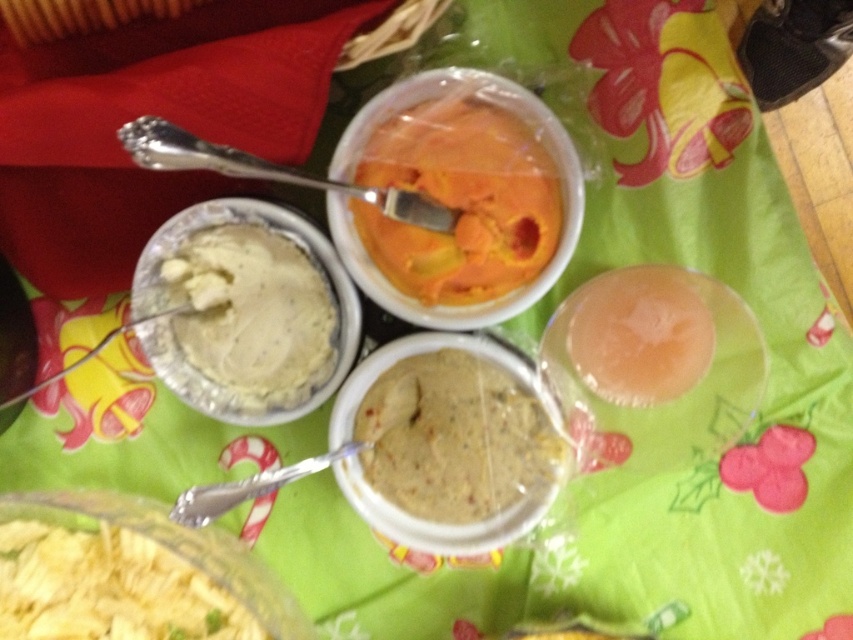
Question: Which point is closer to the camera taking this photo?

Choices:
 (A) (469, 288)
 (B) (674, 305)
 (C) (71, 614)

Answer: (C)

Question: Is orange matte ice cream at center to the right of white creamy paste at center from the viewer's perspective?

Choices:
 (A) no
 (B) yes

Answer: (B)

Question: Which of the following is the closest to the observer?

Choices:
 (A) white creamy paste at center
 (B) translucent plastic cup at center
 (C) yellow crumbly cheese at lower left
 (D) orange matte ice cream at center

Answer: (C)

Question: Among these points, which one is farthest from the camera?

Choices:
 (A) (108, 612)
 (B) (531, 148)
 (C) (610, 337)

Answer: (C)

Question: Is orange matte ice cream at center thinner than yellow crumbly cheese at lower left?

Choices:
 (A) yes
 (B) no

Answer: (A)

Question: Does orange matte ice cream at center come in front of greenish matte dip at center?

Choices:
 (A) yes
 (B) no

Answer: (A)